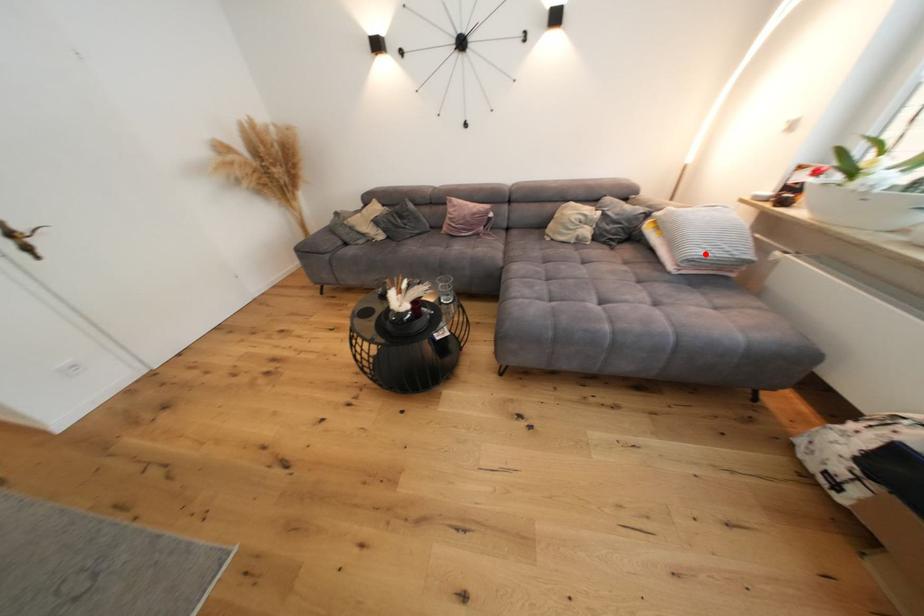
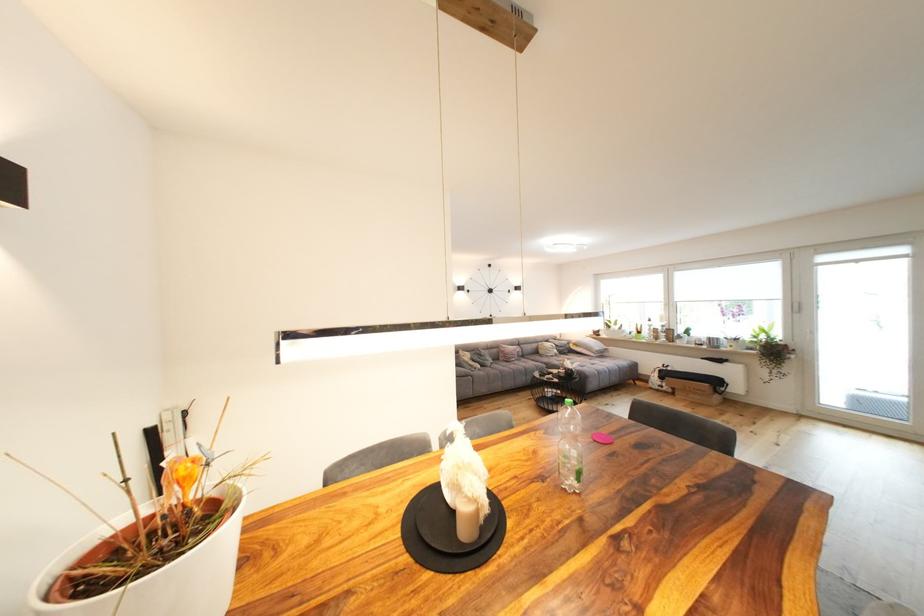
Question: I am providing you with two images of the same scene from different viewpoints. Given a red point in image1, look at the same physical point in image2. Is it:

Choices:
 (A) Closer to the viewpoint
 (B) Farther from the viewpoint

Answer: (B)